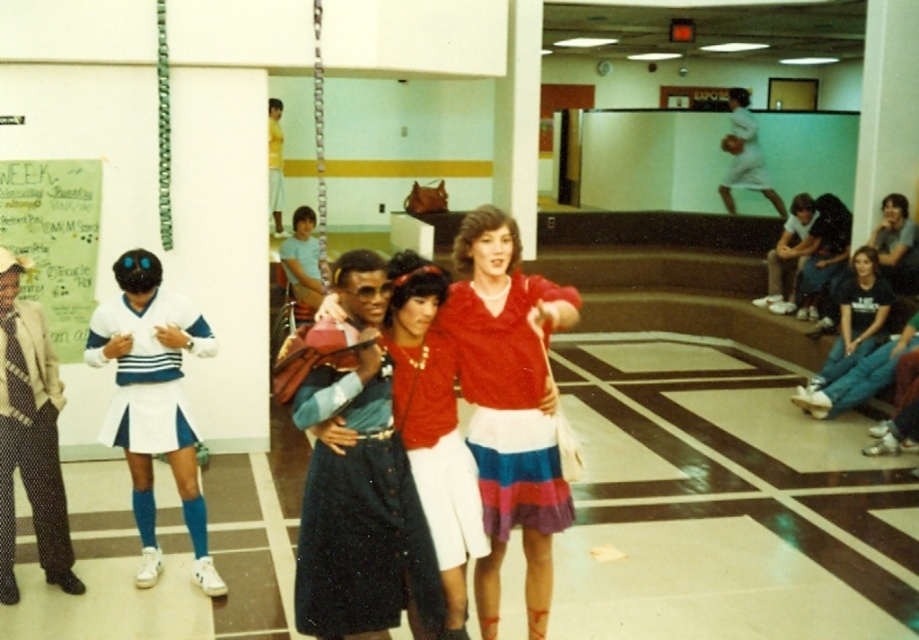
Question: Which object is farther from the camera taking this photo?

Choices:
 (A) matte red sweater at center
 (B) white matte uniform at left

Answer: (B)

Question: Is dark blue textured dress at center positioned before white cotton shirt at upper right?

Choices:
 (A) yes
 (B) no

Answer: (A)

Question: Does white fabric skirt at center have a lesser width compared to yellow fabric shirt at upper center?

Choices:
 (A) no
 (B) yes

Answer: (A)

Question: Which object is the closest to the matte black hair at center?

Choices:
 (A) matte red sweater at center
 (B) white matte uniform at left

Answer: (A)

Question: Which object is closer to the camera taking this photo?

Choices:
 (A) yellow fabric shirt at upper center
 (B) polka dot pants at left

Answer: (B)

Question: Is dark blue textured dress at center in front of matte black hair at center?

Choices:
 (A) no
 (B) yes

Answer: (B)